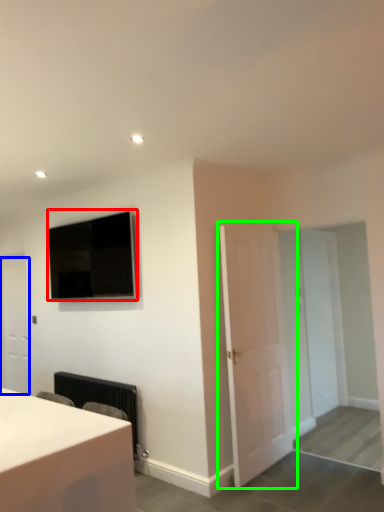
Question: Which object is the farthest from television (highlighted by a red box)? Choose among these: door (highlighted by a blue box) or door (highlighted by a green box).

Choices:
 (A) door
 (B) door

Answer: (B)